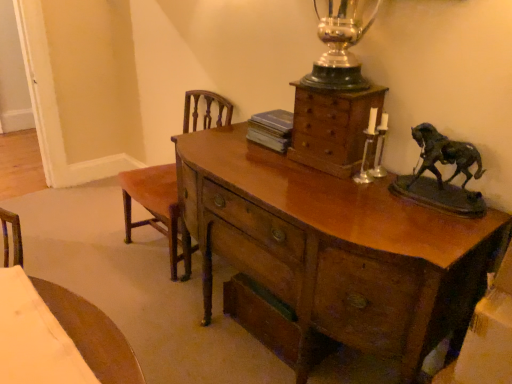
Question: From a real-world perspective, relative to glossy wood desk at center, is brown wood chair at left vertically above or below?

Choices:
 (A) below
 (B) above

Answer: (B)

Question: Is brown wood chair at left situated inside glossy wood desk at center or outside?

Choices:
 (A) outside
 (B) inside

Answer: (A)

Question: Which object is positioned farthest from the brown wood chair at left?

Choices:
 (A) blue paperback book at center
 (B) wooden chest of drawers at upper center
 (C) glossy wood desk at center

Answer: (B)

Question: Based on their relative distances, which object is farther from the glossy wood desk at center?

Choices:
 (A) wooden chest of drawers at upper center
 (B) blue paperback book at center
 (C) brown wood chair at left

Answer: (C)